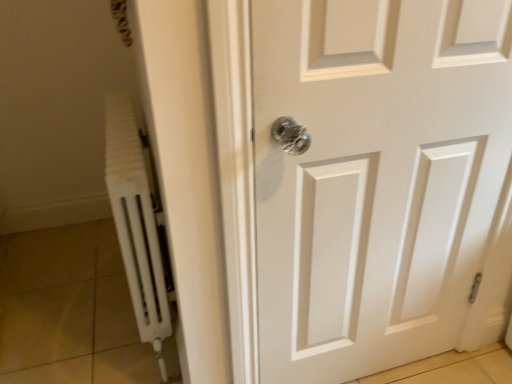
The image size is (512, 384). Find the location of `white matte door at center`. white matte door at center is located at coordinates (381, 182).

What do you see at coordinates (381, 182) in the screenshot?
I see `white matte door at center` at bounding box center [381, 182].

Where is `white matte radiator at left`? Image resolution: width=512 pixels, height=384 pixels. white matte radiator at left is located at coordinates tap(136, 224).

This screenshot has height=384, width=512. Describe the element at coordinates (136, 224) in the screenshot. I see `white matte radiator at left` at that location.

Identify the location of white matte door at center. This screenshot has width=512, height=384. (381, 182).

Is white matte radiator at left to the right of white matte door at center from the viewer's perspective?

In fact, white matte radiator at left is to the left of white matte door at center.

Relative to white matte door at center, is white matte radiator at left in front or behind?

white matte radiator at left is positioned farther from the viewer than white matte door at center.

Is point (118, 141) positioned behind point (509, 276)?

No.

From the image's perspective, which is below, white matte radiator at left or white matte door at center?

white matte door at center, from the image's perspective.

From a real-world perspective, is white matte radiator at left physically located above or below white matte door at center?

In terms of real-world spatial position, white matte radiator at left is below white matte door at center.

Which object is thinner, white matte radiator at left or white matte door at center?

With smaller width is white matte door at center.

Can you confirm if white matte radiator at left is taller than white matte door at center?

No, white matte radiator at left is not taller than white matte door at center.

Between white matte radiator at left and white matte door at center, which one has larger size?

white matte radiator at left is bigger.

Based on the photo, would you say white matte radiator at left is outside white matte door at center?

white matte radiator at left lies outside white matte door at center's area.

Are white matte radiator at left and white matte door at center making contact?

No, white matte radiator at left is not in contact with white matte door at center.

In the scene shown: Is white matte radiator at left oriented towards white matte door at center?

No.

Can you tell me how much white matte radiator at left and white matte door at center differ in facing direction?

90.7 degrees separate the facing orientations of white matte radiator at left and white matte door at center.

Identify the location of radiator to the left of white matte door at center. (136, 224).

Considering the relative positions of white matte door at center and white matte radiator at left in the image provided, is white matte door at center to the right of white matte radiator at left from the viewer's perspective?

Indeed, white matte door at center is positioned on the right side of white matte radiator at left.

Which is behind, white matte door at center or white matte radiator at left?

white matte radiator at left is further away from the camera.

Which is farther, (277, 327) or (142, 259)?

The point (142, 259) is more distant.

From the image's perspective, is white matte door at center on top of white matte radiator at left?

No.

From a real-world perspective, is white matte door at center positioned over white matte radiator at left based on gravity?

Yes.

In terms of width, does white matte door at center look wider or thinner when compared to white matte radiator at left?

In the image, white matte door at center appears to be more narrow than white matte radiator at left.

In terms of height, does white matte door at center look taller or shorter compared to white matte radiator at left?

white matte door at center is taller than white matte radiator at left.

Considering the relative sizes of white matte door at center and white matte radiator at left in the image provided, is white matte door at center bigger than white matte radiator at left?

No, white matte door at center is not bigger than white matte radiator at left.

Is white matte door at center not inside white matte radiator at left?

white matte door at center lies outside white matte radiator at left's area.

Is white matte door at center beside white matte radiator at left?

There is a gap between white matte door at center and white matte radiator at left.

Is white matte door at center facing away from white matte radiator at left?

white matte door at center is not turned away from white matte radiator at left.

How far apart are white matte door at center and white matte radiator at left?

A distance of 22.92 inches exists between white matte door at center and white matte radiator at left.

I want to click on door below the white matte radiator at left (from the image's perspective), so point(381,182).

Locate an element on the screen. The width and height of the screenshot is (512, 384). door above the white matte radiator at left (from a real-world perspective) is located at coordinates (381, 182).

This screenshot has height=384, width=512. Find the location of `door that appears in front of the white matte radiator at left`. door that appears in front of the white matte radiator at left is located at coordinates (381, 182).